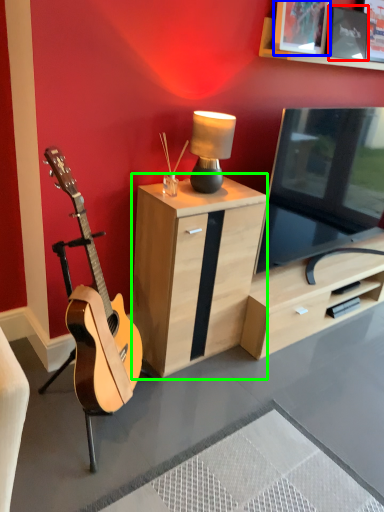
Question: Considering the real-world distances, which object is farthest from picture frame (highlighted by a red box)? picture frame (highlighted by a blue box) or cabinetry (highlighted by a green box)?

Choices:
 (A) picture frame
 (B) cabinetry

Answer: (B)